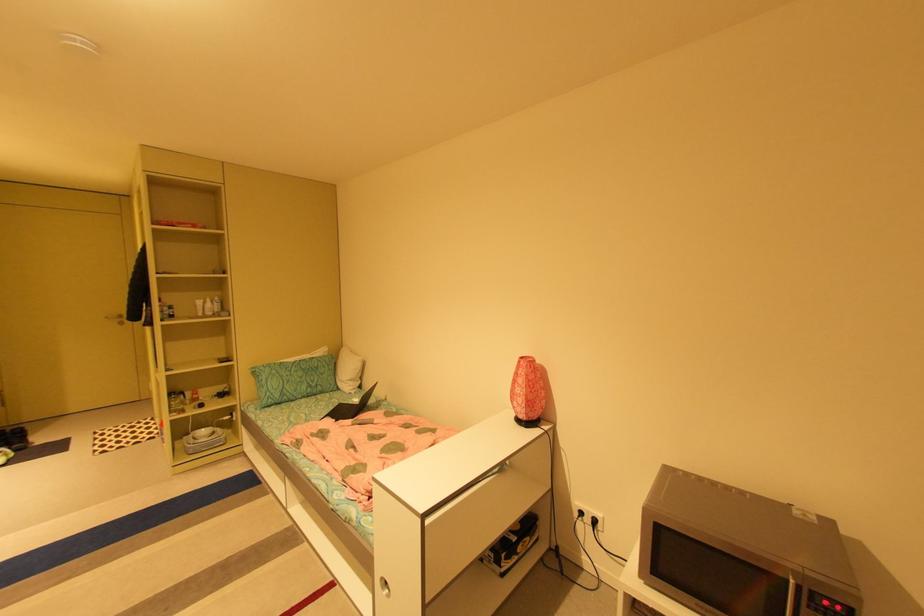
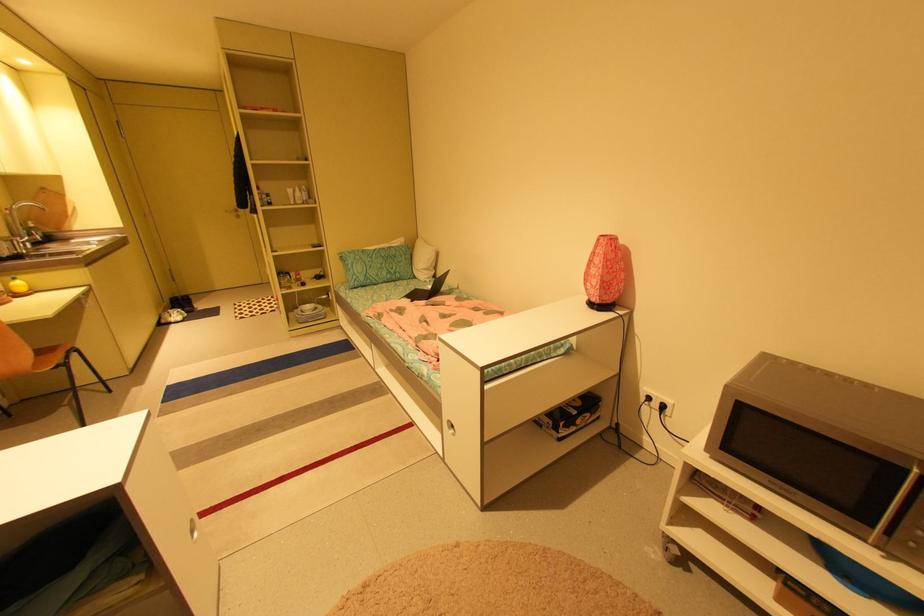
The point at (356,403) is marked in the first image. Where is the corresponding point in the second image?

(431, 290)